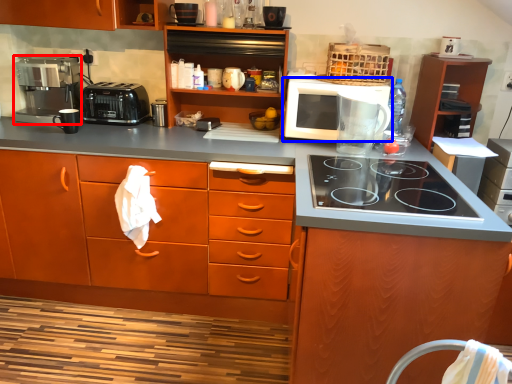
Question: Which object is further to the camera taking this photo, home appliance (highlighted by a red box) or microwave oven (highlighted by a blue box)?

Choices:
 (A) home appliance
 (B) microwave oven

Answer: (A)